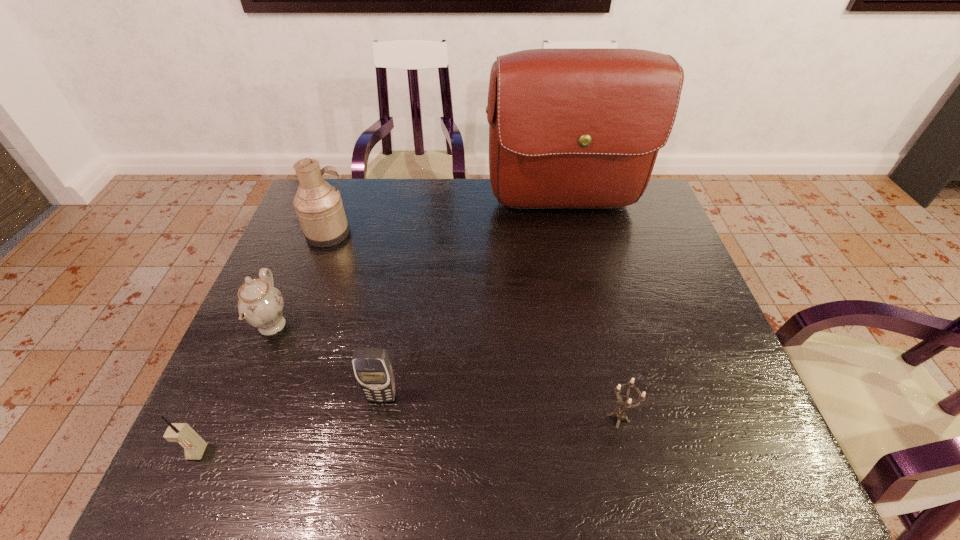
Point out which object is positioned as the fourth nearest to the fifth farthest object. Please provide its 2D coordinates. Your answer should be formatted as a tuple, i.e. [(x, y)], where the tuple contains the x and y coordinates of a point satisfying the conditions above.

[(194, 446)]

At what (x,y) coordinates should I click in order to perform the action: click on free space that satisfies the following two spatial constraints: 1. on the open flap of the satchel; 2. on the left side of the fifth farthest object. Please return your answer as a coordinate pair (x, y). The height and width of the screenshot is (540, 960). Looking at the image, I should click on (611, 418).

I want to click on free spot that satisfies the following two spatial constraints: 1. on the front face of the fourth farthest object; 2. on the left side of the shortest object, so click(x=378, y=418).